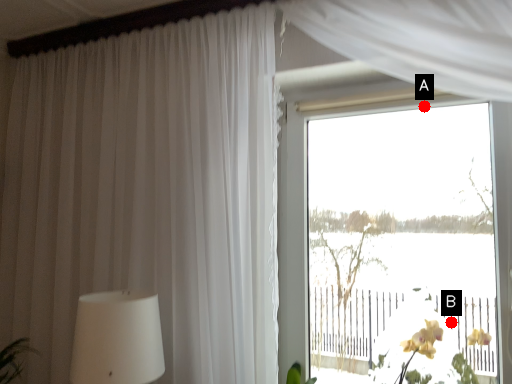
Question: Two points are circled on the image, labeled by A and B beside each circle. Which point is closer to the camera?

Choices:
 (A) A is closer
 (B) B is closer

Answer: (B)